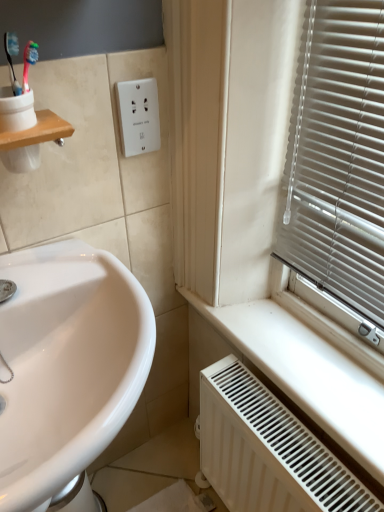
Locate an element on the screen. wooden shelf at upper left is located at coordinates (38, 132).

Measure the distance between point (78, 251) and camera.

Point (78, 251) is 84.70 centimeters from camera.

At what (x,y) coordinates should I click in order to perform the action: click on white matte radiator at lower right. Please return your answer as a coordinate pair (x, y). This screenshot has width=384, height=512. Looking at the image, I should click on (268, 450).

The width and height of the screenshot is (384, 512). Find the location of `wooden shelf at upper left`. wooden shelf at upper left is located at coordinates (38, 132).

The height and width of the screenshot is (512, 384). In order to click on window sill located above the white plastic outlet at upper center (from a real-world perspective) in this screenshot , I will do `click(38, 132)`.

Considering the relative sizes of white plastic outlet at upper center and wooden shelf at upper left in the image provided, is white plastic outlet at upper center smaller than wooden shelf at upper left?

Correct, white plastic outlet at upper center occupies less space than wooden shelf at upper left.

Could you tell me if white plastic outlet at upper center is facing wooden shelf at upper left?

No.

In the scene shown: Is white plastic outlet at upper center not close to wooden shelf at upper left?

Actually, white plastic outlet at upper center and wooden shelf at upper left are a little close together.

Is white matte radiator at lower right shorter than white plastic outlet at upper center?

No, white matte radiator at lower right is not shorter than white plastic outlet at upper center.

Is the position of white matte radiator at lower right more distant than that of white plastic outlet at upper center?

No.

Find the location of a particular element. The height and width of the screenshot is (512, 384). radiator below the white plastic outlet at upper center (from the image's perspective) is located at coordinates pos(268,450).

Consider the image. From the image's perspective, which object appears higher, white matte radiator at lower right or white plastic outlet at upper center?

white plastic outlet at upper center is shown above in the image.

Can you tell me how much white glossy sink at lower left and white plastic outlet at upper center differ in facing direction?

There is a 0.963-degree angle between the facing directions of white glossy sink at lower left and white plastic outlet at upper center.

Do you think white glossy sink at lower left is within white plastic outlet at upper center, or outside of it?

white glossy sink at lower left exists outside the volume of white plastic outlet at upper center.

Looking at their sizes, would you say white glossy sink at lower left is wider or thinner than white plastic outlet at upper center?

white glossy sink at lower left is wider than white plastic outlet at upper center.

Does white glossy sink at lower left have a lesser height compared to white plastic outlet at upper center?

Incorrect, the height of white glossy sink at lower left does not fall short of that of white plastic outlet at upper center.

Is there a large distance between white matte radiator at lower right and white glossy sink at lower left?

No, there isn't a large distance between white matte radiator at lower right and white glossy sink at lower left.

Is white matte radiator at lower right not within white glossy sink at lower left?

Yes, white matte radiator at lower right is located beyond the bounds of white glossy sink at lower left.

Is white matte radiator at lower right at the right side of white glossy sink at lower left?

Yes, white matte radiator at lower right is to the right of white glossy sink at lower left.

From the image's perspective, is white plastic outlet at upper center on top of white glossy sink at lower left?

Yes, from the image's perspective, white plastic outlet at upper center is on top of white glossy sink at lower left.

From a real-world perspective, which is physically below, white plastic outlet at upper center or white glossy sink at lower left?

white glossy sink at lower left, from a real-world perspective.

Considering the points (121, 117) and (26, 471), which point is behind, point (121, 117) or point (26, 471)?

The point (121, 117) is farther.

Is white plastic outlet at upper center spatially inside white glossy sink at lower left, or outside of it?

white plastic outlet at upper center is outside white glossy sink at lower left.

Considering the positions of objects wooden shelf at upper left and white matte radiator at lower right in the image provided, who is more to the left, wooden shelf at upper left or white matte radiator at lower right?

Positioned to the left is wooden shelf at upper left.

From the picture: Is wooden shelf at upper left beside white matte radiator at lower right?

wooden shelf at upper left is not next to white matte radiator at lower right, and they're not touching.

At what (x,y) coordinates should I click in order to perform the action: click on window sill located above the white matte radiator at lower right (from the image's perspective). Please return your answer as a coordinate pair (x, y). Looking at the image, I should click on (38, 132).

Is wooden shelf at upper left wider or thinner than white matte radiator at lower right?

Clearly, wooden shelf at upper left has more width compared to white matte radiator at lower right.

From a real-world perspective, who is located higher, white glossy sink at lower left or white matte radiator at lower right?

From a 3D spatial view, white glossy sink at lower left is above.

Who is bigger, white glossy sink at lower left or white matte radiator at lower right?

white glossy sink at lower left is bigger.

Which is correct: white glossy sink at lower left is inside white matte radiator at lower right, or outside of it?

white glossy sink at lower left is located beyond the bounds of white matte radiator at lower right.

Does white glossy sink at lower left turn towards white matte radiator at lower right?

No, white glossy sink at lower left is not facing towards white matte radiator at lower right.

Find the location of a particular element. electric outlet on the right of the wooden shelf at upper left is located at coordinates (138, 116).

Image resolution: width=384 pixels, height=512 pixels. What are the coordinates of `electric outlet that appears on the left of white matte radiator at lower right` in the screenshot? It's located at (138, 116).

Considering their positions, is white plastic outlet at upper center positioned further to white matte radiator at lower right than wooden shelf at upper left?

wooden shelf at upper left is further to white matte radiator at lower right.

Looking at the image, which one is located closer to wooden shelf at upper left, white plastic outlet at upper center or white matte radiator at lower right?

Based on the image, white plastic outlet at upper center appears to be nearer to wooden shelf at upper left.

When comparing their distances from wooden shelf at upper left, does white glossy sink at lower left or white matte radiator at lower right seem further?

white matte radiator at lower right lies further to wooden shelf at upper left than the other object.

Which object lies further to the anchor point white glossy sink at lower left, white matte radiator at lower right or white plastic outlet at upper center?

The object further to white glossy sink at lower left is white plastic outlet at upper center.

Estimate the real-world distances between objects in this image. Which object is closer to white plastic outlet at upper center, white matte radiator at lower right or white glossy sink at lower left?

The object closer to white plastic outlet at upper center is white glossy sink at lower left.

When comparing their distances from white matte radiator at lower right, does white glossy sink at lower left or wooden shelf at upper left seem further?

Based on the image, wooden shelf at upper left appears to be further to white matte radiator at lower right.

Looking at the image, which one is located further to white glossy sink at lower left, wooden shelf at upper left or white matte radiator at lower right?

white matte radiator at lower right is further to white glossy sink at lower left.

Looking at the image, which one is located further to wooden shelf at upper left, white plastic outlet at upper center or white glossy sink at lower left?

white glossy sink at lower left.

What are the coordinates of `window sill between white plastic outlet at upper center and white matte radiator at lower right in the vertical direction` in the screenshot? It's located at (38, 132).

What are the coordinates of `sink that lies between white plastic outlet at upper center and white matte radiator at lower right from top to bottom` in the screenshot? It's located at (67, 364).

You are a GUI agent. You are given a task and a screenshot of the screen. Output one action in this format:
    pyautogui.click(x=<x>, y=<y>)
    Task: Click on the sink between wooden shelf at upper left and white matte radiator at lower right in the up-down direction
    
    Given the screenshot: What is the action you would take?
    pyautogui.click(x=67, y=364)

At what (x,y) coordinates should I click in order to perform the action: click on window sill between white plastic outlet at upper center and white glossy sink at lower left in the vertical direction. Please return your answer as a coordinate pair (x, y). This screenshot has height=512, width=384. Looking at the image, I should click on (x=38, y=132).